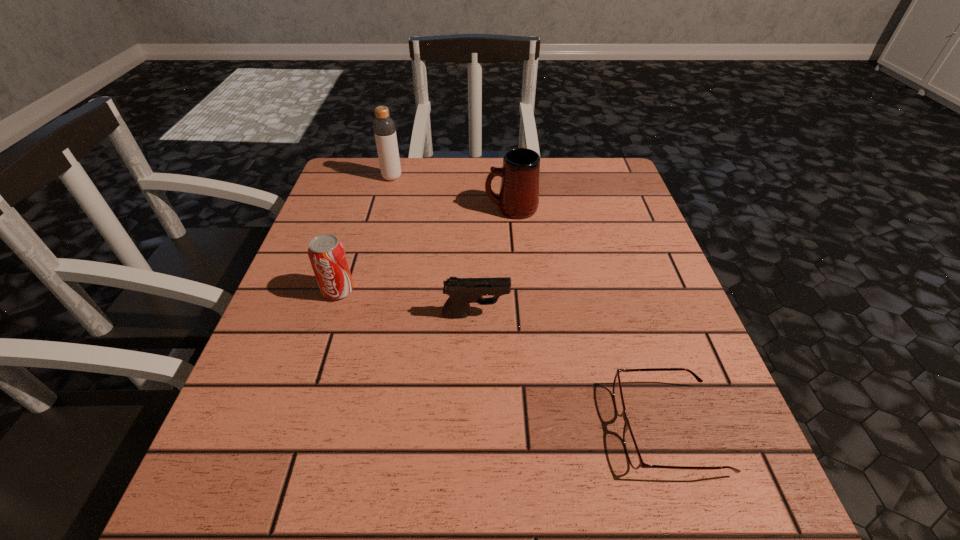
I want to click on the farthest object, so click(x=384, y=127).

Where is `bottle`? Image resolution: width=960 pixels, height=540 pixels. bottle is located at coordinates 384,127.

You are a GUI agent. You are given a task and a screenshot of the screen. Output one action in this format:
    pyautogui.click(x=<x>, y=<y>)
    Task: Click on the mug
    The image size is (960, 540).
    Given the screenshot: What is the action you would take?
    pyautogui.click(x=519, y=192)

This screenshot has width=960, height=540. In order to click on soda can in this screenshot , I will do `click(326, 253)`.

At what (x,y) coordinates should I click in order to perform the action: click on the third farthest object. Please return your answer as a coordinate pair (x, y). The image size is (960, 540). Looking at the image, I should click on (326, 253).

Find the location of a particular element. the fourth tallest object is located at coordinates (462, 291).

At what (x,y) coordinates should I click in order to perform the action: click on the fourth farthest object. Please return your answer as a coordinate pair (x, y). The width and height of the screenshot is (960, 540). Looking at the image, I should click on (462, 291).

The image size is (960, 540). Find the location of `the shortest object`. the shortest object is located at coordinates (634, 457).

Locate an element on the screen. spectacles is located at coordinates (634, 457).

Identify the location of vacant area located on the right of the farthest object. (450, 177).